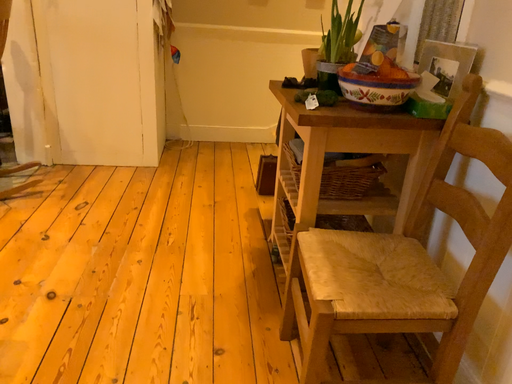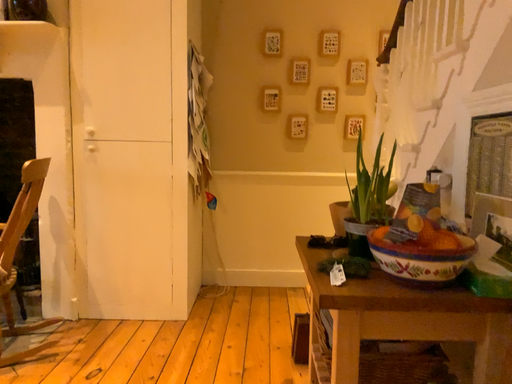
Question: How did the camera likely rotate when shooting the video?

Choices:
 (A) rotated right
 (B) rotated left

Answer: (B)